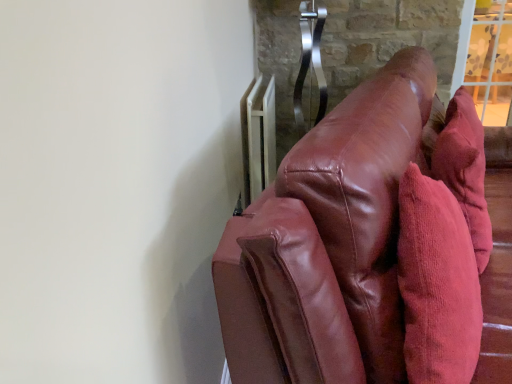
Question: Is shiny brown leather couch at right behind corduroy throw pillow at right?

Choices:
 (A) no
 (B) yes

Answer: (A)

Question: Does shiny brown leather couch at right appear on the right side of corduroy throw pillow at right?

Choices:
 (A) no
 (B) yes

Answer: (A)

Question: Is shiny brown leather couch at right smaller than corduroy throw pillow at right?

Choices:
 (A) yes
 (B) no

Answer: (B)

Question: From a real-world perspective, is shiny brown leather couch at right below corduroy throw pillow at right?

Choices:
 (A) no
 (B) yes

Answer: (B)

Question: Is shiny brown leather couch at right shorter than corduroy throw pillow at right?

Choices:
 (A) no
 (B) yes

Answer: (A)

Question: Could you tell me if shiny brown leather couch at right is facing corduroy throw pillow at right?

Choices:
 (A) no
 (B) yes

Answer: (B)

Question: From a real-world perspective, is white metallic radiator at upper right positioned over shiny brown leather couch at right based on gravity?

Choices:
 (A) yes
 (B) no

Answer: (A)

Question: Is white metallic radiator at upper right next to shiny brown leather couch at right and touching it?

Choices:
 (A) no
 (B) yes

Answer: (A)

Question: Would you say white metallic radiator at upper right is outside shiny brown leather couch at right?

Choices:
 (A) yes
 (B) no

Answer: (A)

Question: Would you say white metallic radiator at upper right contains shiny brown leather couch at right?

Choices:
 (A) no
 (B) yes

Answer: (A)

Question: Can you confirm if white metallic radiator at upper right is bigger than shiny brown leather couch at right?

Choices:
 (A) no
 (B) yes

Answer: (A)

Question: From a real-world perspective, is white metallic radiator at upper right below shiny brown leather couch at right?

Choices:
 (A) yes
 (B) no

Answer: (B)

Question: Is white metallic radiator at upper right looking in the opposite direction of corduroy throw pillow at right?

Choices:
 (A) yes
 (B) no

Answer: (B)